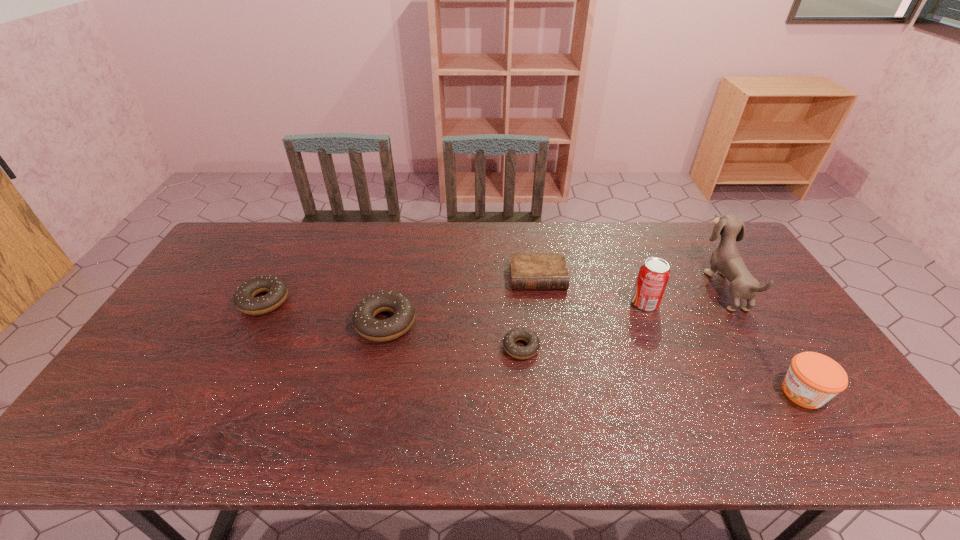
In the image, there is a desktop. Where is `free space at the left edge`? The height and width of the screenshot is (540, 960). free space at the left edge is located at coordinates (204, 280).

The image size is (960, 540). I want to click on vacant position at the right edge of the desktop, so [795, 330].

This screenshot has width=960, height=540. I want to click on free space at the far left corner, so click(242, 245).

Locate an element on the screen. The height and width of the screenshot is (540, 960). blank area at the near left corner is located at coordinates (159, 392).

Where is `free space that is in between the diary and the leftmost object`? This screenshot has width=960, height=540. free space that is in between the diary and the leftmost object is located at coordinates (401, 289).

Identify the location of free space between the diary and the soda can. The image size is (960, 540). (591, 291).

I want to click on vacant area that lies between the second tallest doughnut and the diary, so click(x=401, y=289).

Where is `free space between the second object from left to right and the nearest object`? Image resolution: width=960 pixels, height=540 pixels. free space between the second object from left to right and the nearest object is located at coordinates (594, 358).

This screenshot has height=540, width=960. I want to click on unoccupied area between the diary and the puppy, so click(631, 282).

Where is `vacant area that lies between the second tallest doughnut and the third object from right to left`? The height and width of the screenshot is (540, 960). vacant area that lies between the second tallest doughnut and the third object from right to left is located at coordinates (454, 302).